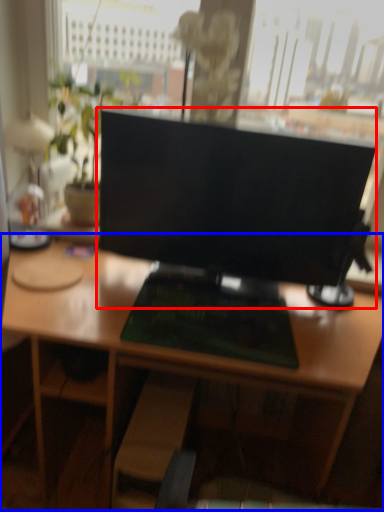
Question: Which object is closer to the camera taking this photo, computer monitor (highlighted by a red box) or desk (highlighted by a blue box)?

Choices:
 (A) computer monitor
 (B) desk

Answer: (B)